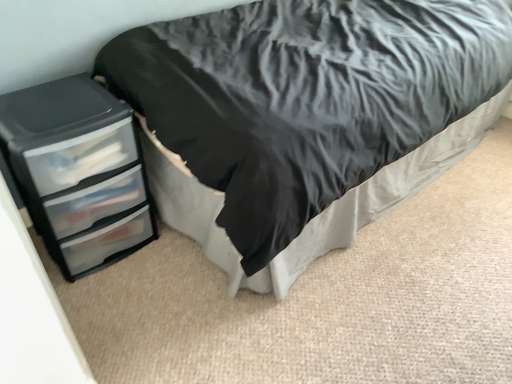
This screenshot has height=384, width=512. Describe the element at coordinates (306, 118) in the screenshot. I see `black matte bed at left` at that location.

I want to click on black matte bed at left, so click(306, 118).

Locate an element on the screen. This screenshot has width=512, height=384. black plastic chest of drawers at left is located at coordinates (78, 172).

This screenshot has height=384, width=512. Describe the element at coordinates (78, 172) in the screenshot. I see `black plastic chest of drawers at left` at that location.

Identify the location of black matte bed at left. (306, 118).

Which object is positioned more to the right, black plastic chest of drawers at left or black matte bed at left?

From the viewer's perspective, black matte bed at left appears more on the right side.

Does black plastic chest of drawers at left come in front of black matte bed at left?

No, black plastic chest of drawers at left is further to the viewer.

Is point (6, 137) positioned before point (467, 148)?

Yes, point (6, 137) is closer to viewer.

From the image's perspective, relative to black matte bed at left, is black plastic chest of drawers at left above or below?

Based on their image positions, black plastic chest of drawers at left is located beneath black matte bed at left.

From a real-world perspective, is black plastic chest of drawers at left positioned over black matte bed at left based on gravity?

No, from a real-world perspective, black plastic chest of drawers at left is not over black matte bed at left

Does black plastic chest of drawers at left have a lesser width compared to black matte bed at left?

Indeed, black plastic chest of drawers at left has a lesser width compared to black matte bed at left.

Considering the relative sizes of black plastic chest of drawers at left and black matte bed at left in the image provided, is black plastic chest of drawers at left shorter than black matte bed at left?

Correct, black plastic chest of drawers at left is not as tall as black matte bed at left.

Considering the relative sizes of black plastic chest of drawers at left and black matte bed at left in the image provided, is black plastic chest of drawers at left smaller than black matte bed at left?

Correct, black plastic chest of drawers at left occupies less space than black matte bed at left.

Is black plastic chest of drawers at left completely or partially outside of black matte bed at left?

Yes, black plastic chest of drawers at left is located beyond the bounds of black matte bed at left.

Does black plastic chest of drawers at left touch black matte bed at left?

No, black plastic chest of drawers at left is not making contact with black matte bed at left.

Is black plastic chest of drawers at left aimed at black matte bed at left?

No.

How many degrees apart are the facing directions of black plastic chest of drawers at left and black matte bed at left?

black plastic chest of drawers at left and black matte bed at left are facing 87.1 degrees away from each other.

You are a GUI agent. You are given a task and a screenshot of the screen. Output one action in this format:
    pyautogui.click(x=<x>, y=<y>)
    Task: Click on the bed positioned vertically above the black plastic chest of drawers at left (from a real-world perspective)
    This screenshot has height=384, width=512.
    Given the screenshot: What is the action you would take?
    pyautogui.click(x=306, y=118)

Which object is positioned more to the right, black matte bed at left or black plastic chest of drawers at left?

black matte bed at left is more to the right.

Does black matte bed at left come behind black plastic chest of drawers at left?

That is False.

Which is closer, (175, 163) or (61, 159)?

Point (175, 163).

From the image's perspective, is black matte bed at left beneath black plastic chest of drawers at left?

No, from the image's perspective, black matte bed at left is not beneath black plastic chest of drawers at left.

From a real-world perspective, which is physically below, black matte bed at left or black plastic chest of drawers at left?

black plastic chest of drawers at left, from a real-world perspective.

Is black matte bed at left thinner than black plastic chest of drawers at left?

No, black matte bed at left is not thinner than black plastic chest of drawers at left.

From the picture: Between black matte bed at left and black plastic chest of drawers at left, which one has less height?

Standing shorter between the two is black plastic chest of drawers at left.

Considering the sizes of objects black matte bed at left and black plastic chest of drawers at left in the image provided, who is bigger, black matte bed at left or black plastic chest of drawers at left?

black matte bed at left.

From the picture: Is black matte bed at left outside of black plastic chest of drawers at left?

That's correct, black matte bed at left is outside of black plastic chest of drawers at left.

Is black matte bed at left placed right next to black plastic chest of drawers at left?

There is a gap between black matte bed at left and black plastic chest of drawers at left.

Is black matte bed at left turned away from black plastic chest of drawers at left?

That's not correct — black matte bed at left is not looking away from black plastic chest of drawers at left.

How much distance is there between black matte bed at left and black plastic chest of drawers at left?

black matte bed at left and black plastic chest of drawers at left are 21.36 inches apart.

Image resolution: width=512 pixels, height=384 pixels. What are the coordinates of `chest of drawers behind the black matte bed at left` in the screenshot? It's located at (78, 172).

In order to click on the chest of drawers below the black matte bed at left (from a real-world perspective) in this screenshot , I will do `click(78, 172)`.

What are the coordinates of `the chest of drawers lying behind the black matte bed at left` in the screenshot? It's located at tap(78, 172).